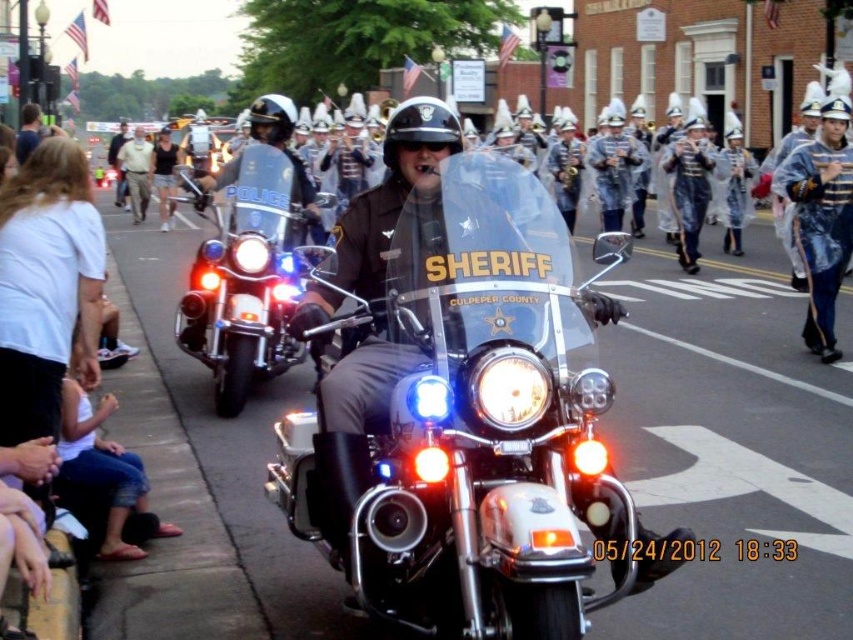
You are a photographer trying to capture both the polished chrome motorcycle at center and the shiny chrome police motorcycle at center in a single frame. Which motorcycle should you position closer to the camera to ensure both appear roughly the same size in your photo?

To make both motorcycles appear roughly the same size in the photo, position the polished chrome motorcycle at center closer to the camera since it has a lesser height compared to the shiny chrome police motorcycle at center.

You are a photographer standing at the origin point of the coordinate system. You want to capture a photo of the polished chrome motorcycle at center. According to the coordinates provided, in which direction should you move to get closer to the motorcycle?

The polished chrome motorcycle at center is located at coordinates point (x=457, y=440). Since you are at the origin point, you should move in the positive x and positive y direction to reach the motorcycle.

You are standing at the point marked by the coordinates point (457, 440) in the image. What object are you touching?

The point (457, 440) is on the polished chrome motorcycle at center, so you are touching the polished chrome motorcycle at center.